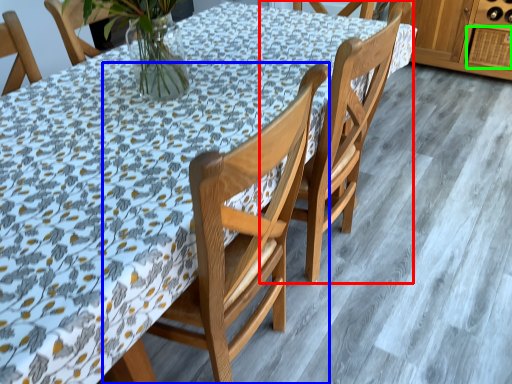
Question: Estimate the real-world distances between objects in this image. Which object is closer to chair (highlighted by a red box), chair (highlighted by a blue box) or drawer (highlighted by a green box)?

Choices:
 (A) chair
 (B) drawer

Answer: (A)